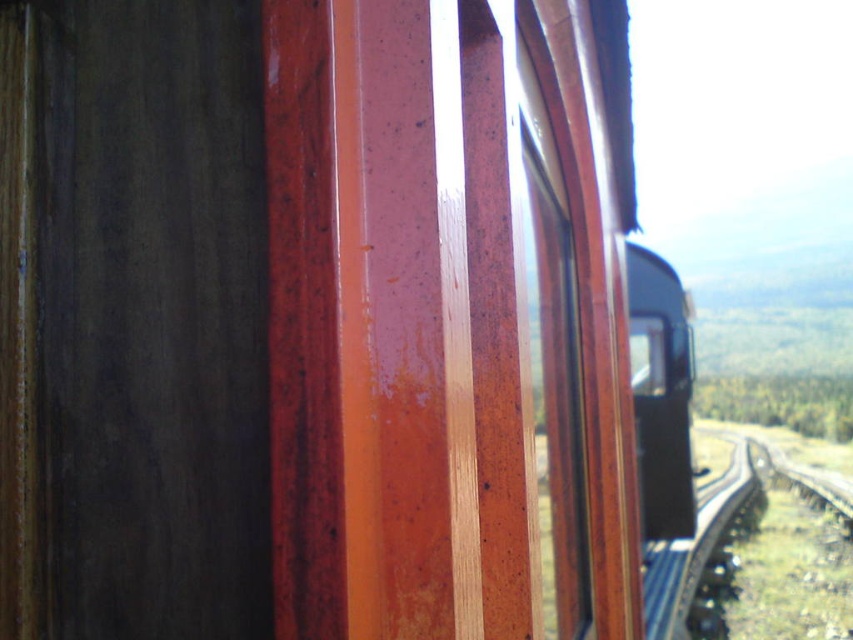
Question: Does glossy wood window at upper right come in front of smooth asphalt train track at right?

Choices:
 (A) yes
 (B) no

Answer: (A)

Question: Which of the following is the closest to the observer?

Choices:
 (A) (567, 381)
 (B) (735, 636)

Answer: (A)

Question: Does glossy wood window at upper right appear under smooth asphalt train track at right?

Choices:
 (A) yes
 (B) no

Answer: (B)

Question: Which of the following is the closest to the observer?

Choices:
 (A) (554, 346)
 (B) (830, 545)

Answer: (A)

Question: Is glossy wood window at upper right to the right of smooth asphalt train track at right from the viewer's perspective?

Choices:
 (A) yes
 (B) no

Answer: (B)